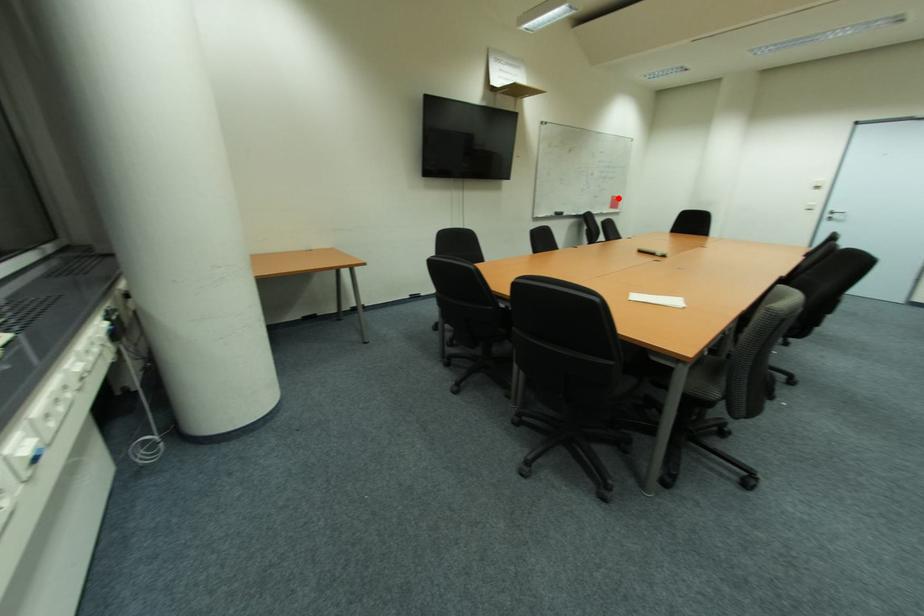
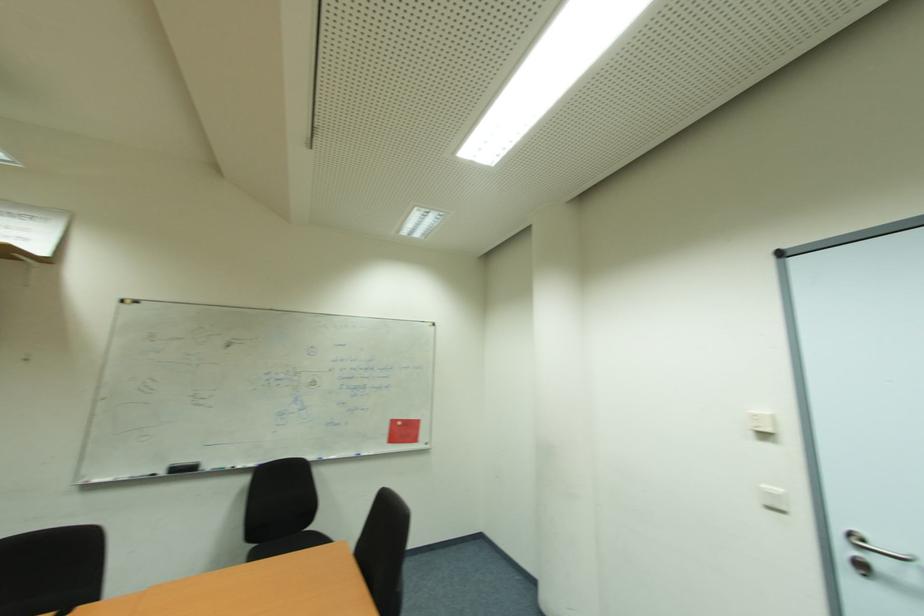
Question: I am providing you with two images of the same scene from different viewpoints. A red point is shown in image1. For the corresponding object point in image2, is it positioned nearer or farther from the camera?

Choices:
 (A) Nearer
 (B) Farther

Answer: (B)